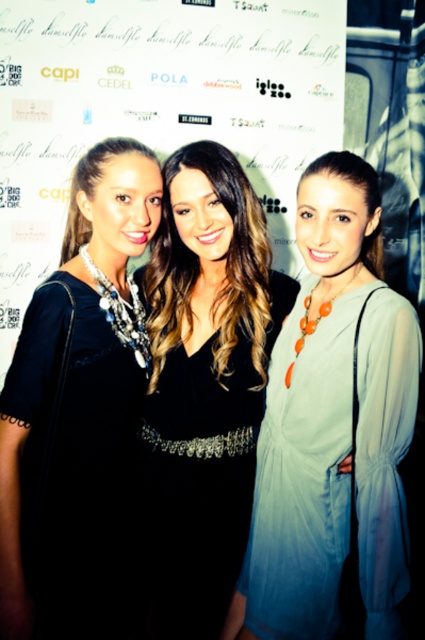
You are a photographer at the event and need to adjust the lighting so that the white paper at center and the matte black dress at left are both clearly visible. Which object should you focus on first to ensure proper exposure?

The white paper at center should be focused on first because it is lighter in color and located above the matte black dress at left, ensuring that the brighter area is properly exposed before adjusting for the darker dress.

What is the exact coordinate of the white paper at center in the image?

The white paper at center is located at point (156, 108).

You are a photographer at the event and need to adjust the lighting between the matte blue dress at center and the black satin dress at center. Given the distance between them, can you estimate if a single light source placed centrally will evenly illuminate both dresses?

The distance between the matte blue dress at center and the black satin dress at center is 7.21 inches. A single centrally placed light source could potentially provide even illumination if the light has a wide enough spread to cover both dresses without significant falloff at that distance.